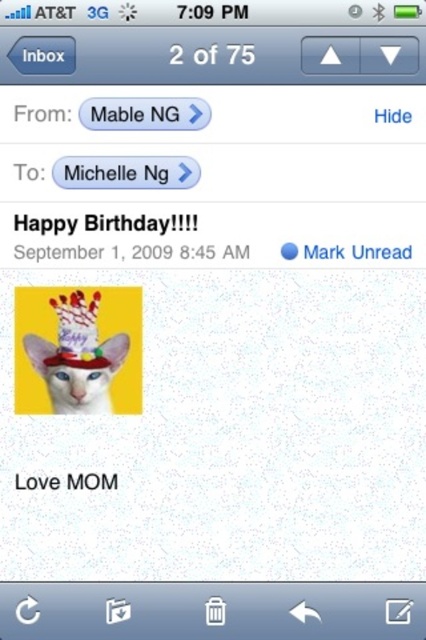
You are holding a mobile phone at a distance of 1 meter from your eyes. A point on the screen is located at coordinates point (39,365). If the distance between you and this point is 1.17 meters, is the phone tilted upwards or downwards relative to your line of sight?

The point (39,365) is 1.17 meters away from the viewer, which is farther than the phone itself held at 1 meter. This suggests the phone is tilted upwards, creating a greater distance between the viewer and the point on the screen.

You are using a mobile device to check your emails. You see the white matte cat at center and the white paper text at upper center. Which object takes up more vertical space on the screen?

The white matte cat at center has a greater height compared to the white paper text at upper center, so it takes up more vertical space.

You are holding a phone with a cracked screen and want to avoid touching the cracked area. The white matte cat at center and the white paper text at upper center are both on the screen. Which object is closer to the bottom edge of the screen so you can safely tap it without hitting the crack near the top?

The white matte cat at center is closer to the bottom edge of the screen than the white paper text at upper center. You can safely tap the white matte cat at center without hitting the crack near the top.